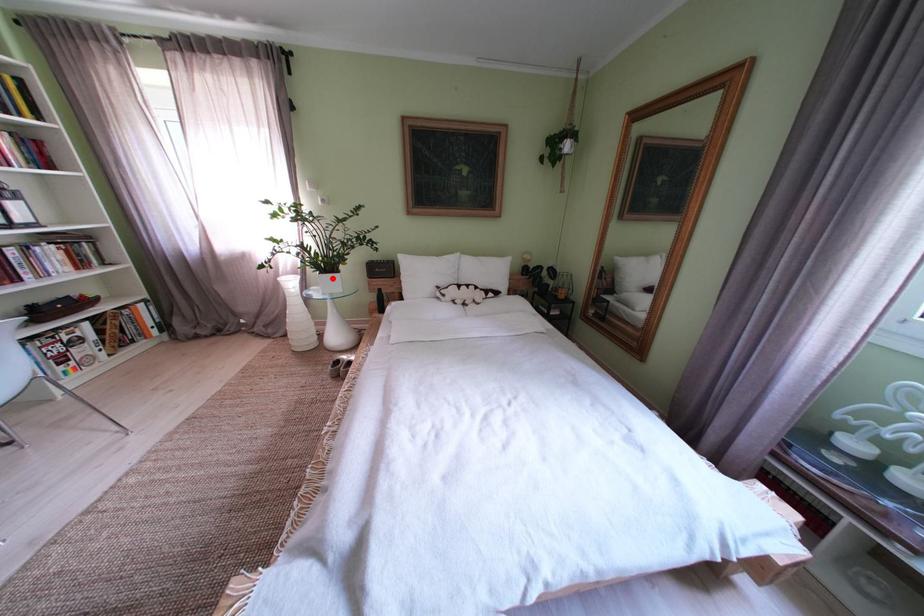
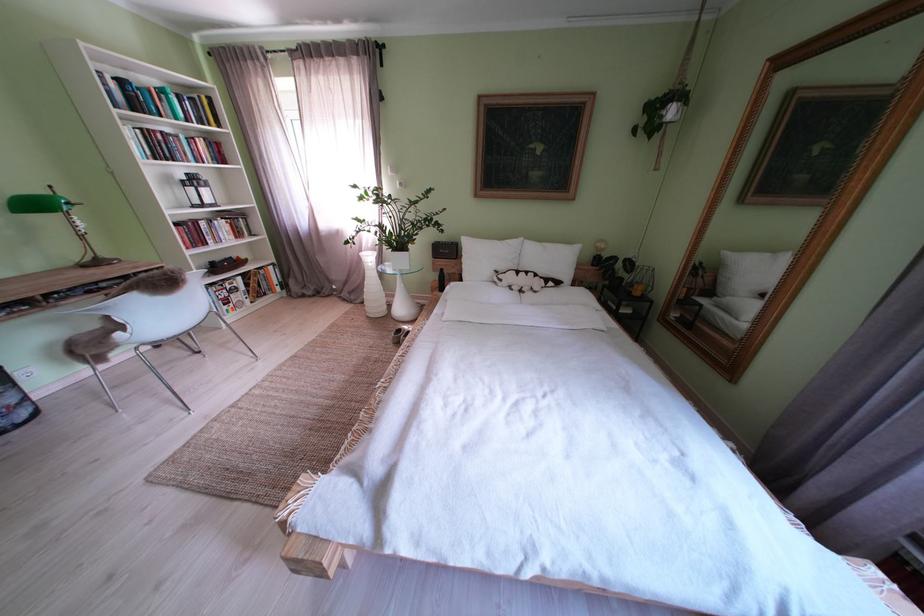
Question: I am providing you with two images of the same scene from different viewpoints. A red point is marked on the first image. Can you still see the location of the red point in image 2?

Choices:
 (A) Yes
 (B) No

Answer: (A)